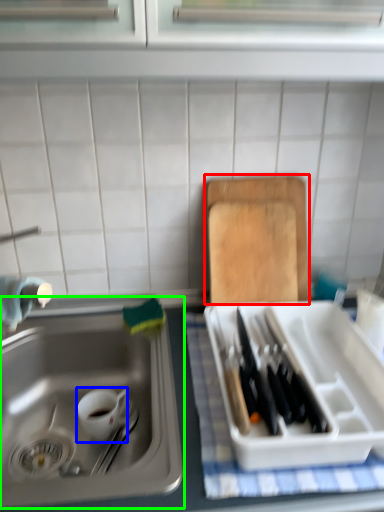
Question: Considering the real-world distances, which object is farthest from cutting board (highlighted by a red box)? tableware (highlighted by a blue box) or sink (highlighted by a green box)?

Choices:
 (A) tableware
 (B) sink

Answer: (A)